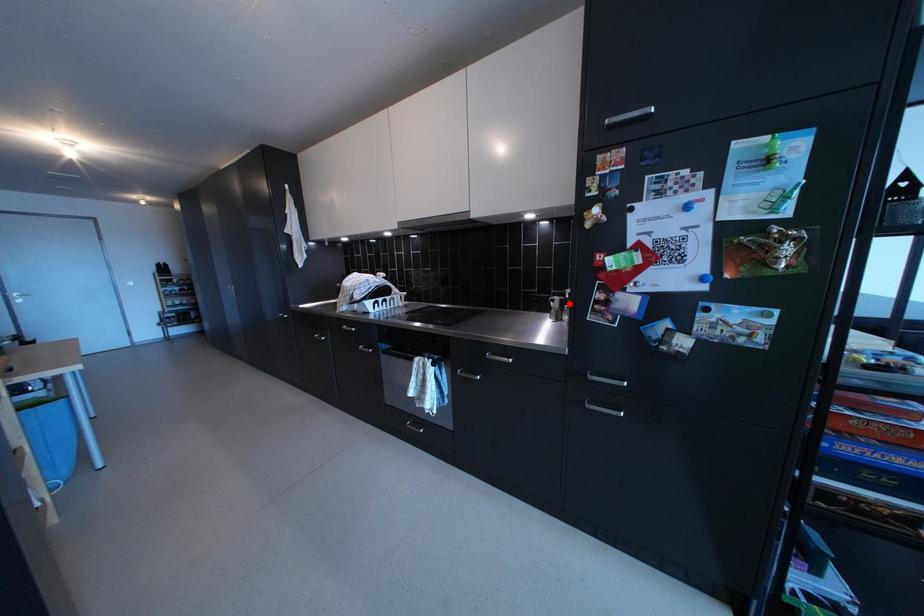
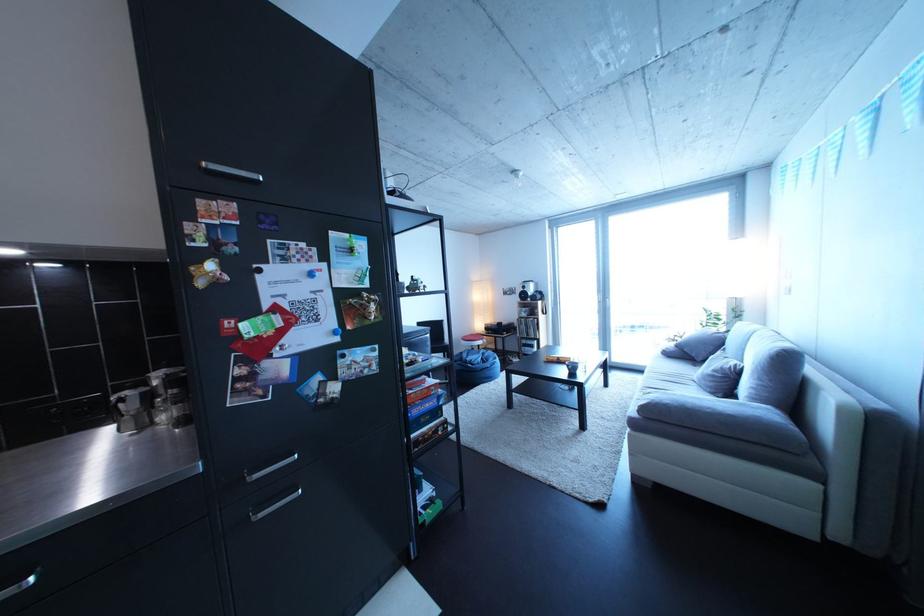
Where in the second image is the point corresponding to the highlighted location from the first image?

(140, 399)